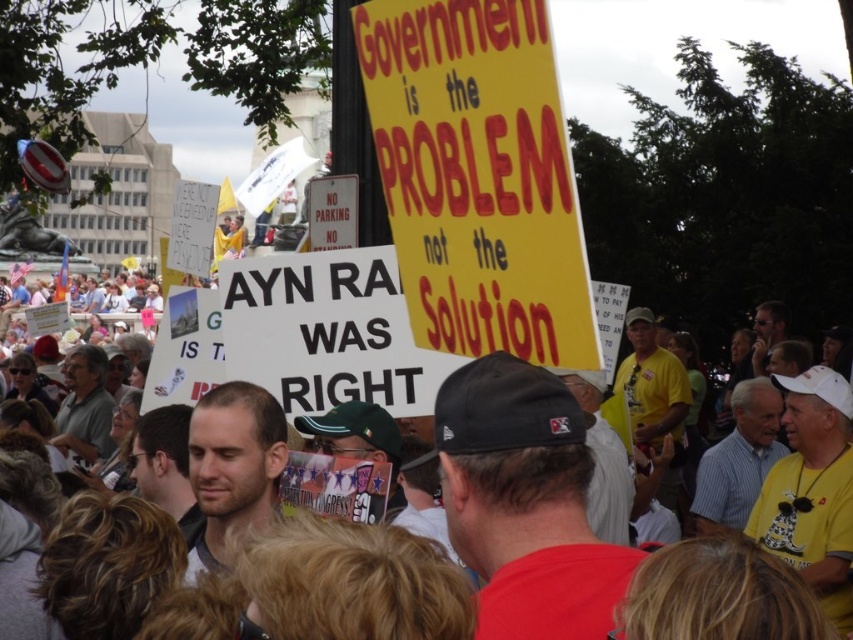
Question: Considering the real-world distances, which object is farthest from the red fabric cap at center?

Choices:
 (A) yellow t-shirt at center
 (B) light brown hair at center

Answer: (A)

Question: Among these points, which one is nearest to the camera?

Choices:
 (A) (498, 461)
 (B) (77, 371)
 (C) (181, 524)

Answer: (A)

Question: Is light blue shirt at center above gray shirt at left?

Choices:
 (A) no
 (B) yes

Answer: (A)

Question: Is red fabric cap at center smaller than smooth skin face at center?

Choices:
 (A) no
 (B) yes

Answer: (A)

Question: Does red fabric cap at center appear over yellow t-shirt at center?

Choices:
 (A) yes
 (B) no

Answer: (B)

Question: Which point is closer to the camera?

Choices:
 (A) light brown hair at center
 (B) smooth skin face at center

Answer: (A)